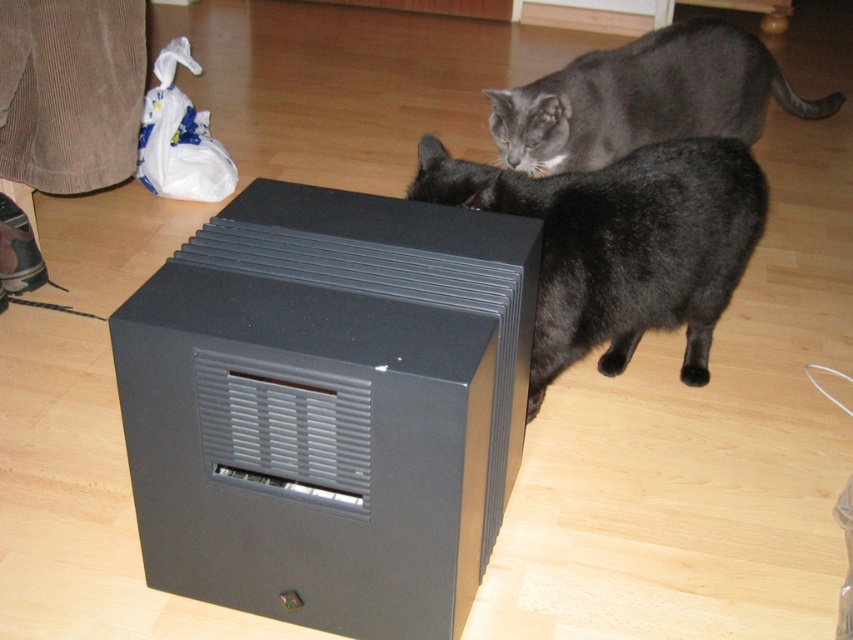
Question: Does black matte/black fur cat at right have a smaller size compared to gray fur cat at upper center?

Choices:
 (A) yes
 (B) no

Answer: (A)

Question: Is black matte/black fur cat at right to the right of gray fur cat at upper center from the viewer's perspective?

Choices:
 (A) yes
 (B) no

Answer: (B)

Question: Which object is the closest to the brown corduroy pants at left?

Choices:
 (A) matte black box at center
 (B) black matte/black fur cat at right

Answer: (A)

Question: Which of the following is the closest to the observer?

Choices:
 (A) brown corduroy pants at left
 (B) matte black box at center
 (C) black matte/black fur cat at right

Answer: (B)

Question: In this image, where is black matte/black fur cat at right located relative to brown corduroy pants at left?

Choices:
 (A) below
 (B) above

Answer: (A)

Question: Which of these objects is positioned farthest from the matte black box at center?

Choices:
 (A) brown corduroy pants at left
 (B) black matte/black fur cat at right

Answer: (A)